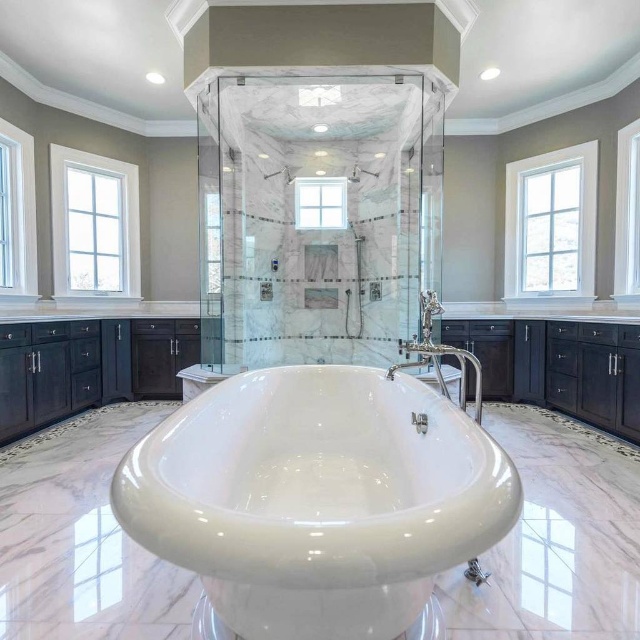
You are standing in the bathroom and want to know which object is taller between the white glass window at left and the polished chrome faucet at center. Based on the scene description, can you determine which one is taller?

The white glass window at left is much taller than the polished chrome faucet at center according to the description.

You are a window cleaner standing in the bathroom and need to clean the white wood window at upper right. The white glossy bathtub at center is in the way. Can you move the bathtub to access the window?

The white glossy bathtub at center is below the white wood window at upper right, so you cannot move the bathtub because it is a fixed structure and located directly under the window, making it impossible to access the window without moving the bathtub.